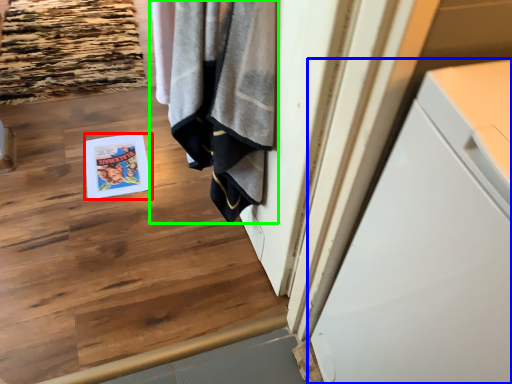
Question: Estimate the real-world distances between objects in this image. Which object is closer to magazine (highlighted by a red box), cabinetry (highlighted by a blue box) or bath towel (highlighted by a green box)?

Choices:
 (A) cabinetry
 (B) bath towel

Answer: (B)